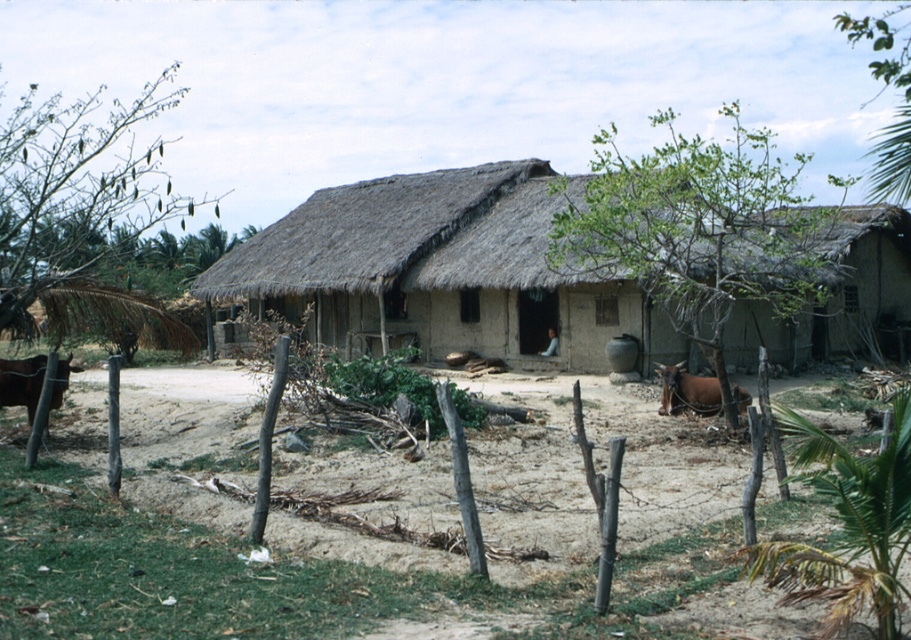
You are standing in the yard of the thatched roof hut at center and want to see the brown leather cow at left. Which direction should you look to see the cow?

The brown leather cow at left is located to the left side of the thatched roof hut at center, so you should look to your left to see the cow.

You are standing in the yard of the thatched house and notice the brown dirt field at center and the brown leather cow at center. Which object is closer to you?

The brown leather cow at center is closer to you because the brown dirt field at center is positioned under it, indicating the cow is above the field and thus nearer.

Looking at this image, you are standing in the dirt yard in front of the thatched roof hut at center and want to get a better view of the brown leather cow at left. Which direction should you move to see it more clearly?

The thatched roof hut at center is positioned over the brown leather cow at left, so you should move to the left side of the thatched roof hut at center to get a better view of the brown leather cow at left.